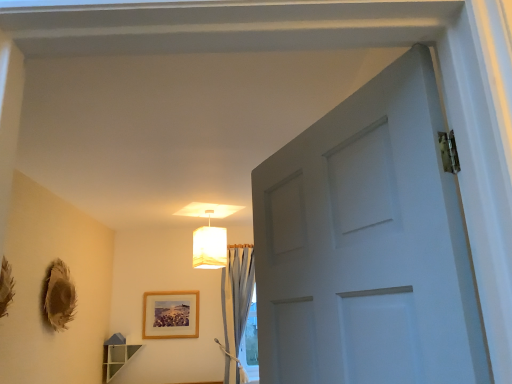
What is the approximate width of light blue sheer curtain at center?

light blue sheer curtain at center is 8.73 inches wide.

The image size is (512, 384). What do you see at coordinates (236, 301) in the screenshot? I see `light blue sheer curtain at center` at bounding box center [236, 301].

Where is `light blue sheer curtain at center`? This screenshot has height=384, width=512. light blue sheer curtain at center is located at coordinates (236, 301).

Which object is wider, light blue sheer curtain at center or white fabric lampshade at upper center?

With larger width is white fabric lampshade at upper center.

From a real-world perspective, is light blue sheer curtain at center positioned over white fabric lampshade at upper center based on gravity?

No, from a real-world perspective, light blue sheer curtain at center is not on top of white fabric lampshade at upper center.

How many degrees apart are the facing directions of light blue sheer curtain at center and white fabric lampshade at upper center?

27.8 degrees.

Which point is more forward, (229, 329) or (220, 232)?

The point (220, 232) is closer.

From a real-world perspective, which object rests below the other?

wooden frame at center, from a real-world perspective.

Who is smaller, white fabric lampshade at upper center or wooden frame at center?

With smaller size is wooden frame at center.

Is white fabric lampshade at upper center aimed at wooden frame at center?

No, white fabric lampshade at upper center is not facing towards wooden frame at center.

Considering the relative positions of white fabric lampshade at upper center and wooden frame at center in the image provided, is white fabric lampshade at upper center to the right of wooden frame at center from the viewer's perspective?

Correct, you'll find white fabric lampshade at upper center to the right of wooden frame at center.

From the image's perspective, between white fabric lampshade at upper center and light blue sheer curtain at center, who is located below?

light blue sheer curtain at center.

From a real-world perspective, is white fabric lampshade at upper center physically above light blue sheer curtain at center?

Yes, from a real-world perspective, white fabric lampshade at upper center is above light blue sheer curtain at center.

Is white fabric lampshade at upper center wider than light blue sheer curtain at center?

Indeed, white fabric lampshade at upper center has a greater width compared to light blue sheer curtain at center.

Can you tell me how much white fabric lampshade at upper center and light blue sheer curtain at center differ in facing direction?

The angle between the facing direction of white fabric lampshade at upper center and the facing direction of light blue sheer curtain at center is 27.8 degrees.

Can we say wooden frame at center lies outside white fabric lampshade at upper center?

wooden frame at center lies outside white fabric lampshade at upper center's area.

Is wooden frame at center in contact with white fabric lampshade at upper center?

No, wooden frame at center is not next to white fabric lampshade at upper center.

Is point (149, 310) positioned after point (200, 232)?

Yes, it is.

Is wooden frame at center in front of or behind white fabric lampshade at upper center in the image?

Visually, wooden frame at center is located behind white fabric lampshade at upper center.

Considering the sizes of objects light blue sheer curtain at center and wooden frame at center in the image provided, who is smaller, light blue sheer curtain at center or wooden frame at center?

Smaller between the two is wooden frame at center.

Considering the relative positions of light blue sheer curtain at center and wooden frame at center in the image provided, is light blue sheer curtain at center in front of wooden frame at center?

Yes, light blue sheer curtain at center is closer to the viewer.

At what (x,y) coordinates should I click in order to perform the action: click on curtain on the right of wooden frame at center. Please return your answer as a coordinate pair (x, y). The image size is (512, 384). Looking at the image, I should click on (236, 301).

What's the angular difference between wooden frame at center and light blue sheer curtain at center's facing directions?

wooden frame at center and light blue sheer curtain at center are facing 0.018 degrees away from each other.

Would you say light blue sheer curtain at center is part of wooden frame at center's contents?

No, light blue sheer curtain at center is located outside of wooden frame at center.

Does wooden frame at center have a greater width compared to light blue sheer curtain at center?

Incorrect, the width of wooden frame at center does not surpass that of light blue sheer curtain at center.

There is a light blue sheer curtain at center. At what (x,y) coordinates should I click in order to perform the action: click on picture frame above it (from a real-world perspective). Please return your answer as a coordinate pair (x, y). Looking at the image, I should click on (170, 315).

The height and width of the screenshot is (384, 512). In order to click on lamp that is in front of the light blue sheer curtain at center in this screenshot , I will do `click(209, 246)`.

Where is `picture frame below the white fabric lampshade at upper center (from the image's perspective)`? picture frame below the white fabric lampshade at upper center (from the image's perspective) is located at coordinates (170, 315).

Considering their positions, is wooden frame at center positioned further to light blue sheer curtain at center than white fabric lampshade at upper center?

The object further to light blue sheer curtain at center is white fabric lampshade at upper center.

Estimate the real-world distances between objects in this image. Which object is further from white fabric lampshade at upper center, light blue sheer curtain at center or wooden frame at center?

wooden frame at center.

Looking at the image, which one is located further to light blue sheer curtain at center, white fabric lampshade at upper center or wooden frame at center?

Based on the image, white fabric lampshade at upper center appears to be further to light blue sheer curtain at center.

Considering their positions, is white fabric lampshade at upper center positioned closer to wooden frame at center than light blue sheer curtain at center?

light blue sheer curtain at center.

Looking at the image, which one is located closer to white fabric lampshade at upper center, wooden frame at center or light blue sheer curtain at center?

The object closer to white fabric lampshade at upper center is light blue sheer curtain at center.

Considering their positions, is light blue sheer curtain at center positioned closer to wooden frame at center than white fabric lampshade at upper center?

Based on the image, light blue sheer curtain at center appears to be nearer to wooden frame at center.

You are a GUI agent. You are given a task and a screenshot of the screen. Output one action in this format:
    pyautogui.click(x=<x>, y=<y>)
    Task: Click on the curtain between white fabric lampshade at upper center and wooden frame at center vertically
    
    Given the screenshot: What is the action you would take?
    pyautogui.click(x=236, y=301)